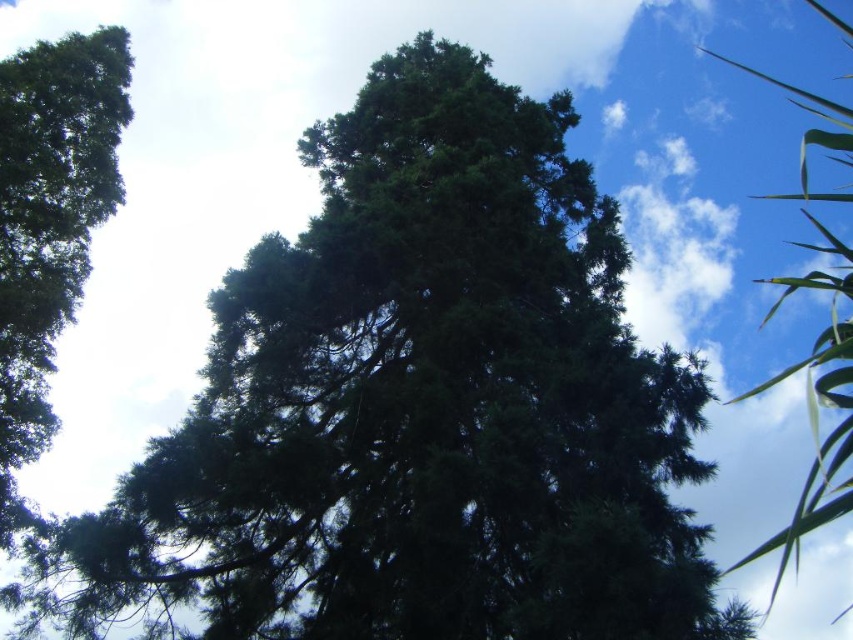
How distant is green needle-like tree at left from green leafy tree at upper right?

green needle-like tree at left and green leafy tree at upper right are 15.52 meters apart from each other.

Can you confirm if green needle-like tree at left is smaller than green leafy tree at upper right?

Yes, green needle-like tree at left is smaller than green leafy tree at upper right.

Identify the location of green needle-like tree at left. The image size is (853, 640). (50, 220).